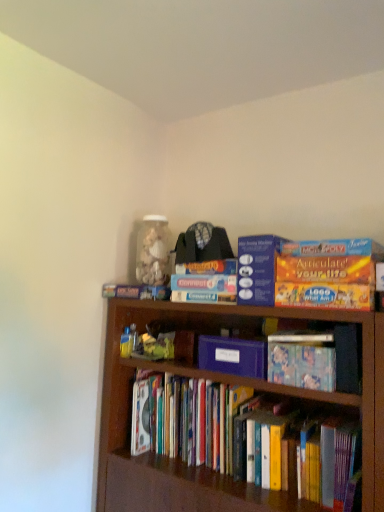
Question: From a real-world perspective, relative to blue cardboard connect 4 game at upper center, arranged as the third book when ordered from the bottom, is hardcover books at center, which ranks as the 1th book in bottom-to-top order, vertically above or below?

Choices:
 (A) below
 (B) above

Answer: (A)

Question: Considering the relative positions of hardcover books at center, which ranks as the 1th book in bottom-to-top order, and blue cardboard connect 4 game at upper center, which is the 1th book in top-to-bottom order, in the image provided, is hardcover books at center, which ranks as the 1th book in bottom-to-top order, to the left or to the right of blue cardboard connect 4 game at upper center, which is the 1th book in top-to-bottom order,?

Choices:
 (A) left
 (B) right

Answer: (B)

Question: Considering the real-world distances, which object is farthest from the purple matte paper at center, marked as the 1th paperback book in a bottom-to-top arrangement?

Choices:
 (A) hardcover books at center, which ranks as the 1th book in bottom-to-top order
 (B) hardcover book at center, which appears as the 2th book when viewed from the top
 (C) blue cardboard connect 4 game at upper center, which is the 1th book in top-to-bottom order
 (D) orange matte board game at upper center, which appears as the second paperback book when ordered from the bottom

Answer: (A)

Question: Considering the real-world distances, which object is closest to the hardcover books at center, placed as the third book when sorted from top to bottom?

Choices:
 (A) blue cardboard connect 4 game at upper center, which is the 1th book in top-to-bottom order
 (B) orange matte board game at upper center, which appears as the second paperback book when ordered from the bottom
 (C) hardcover book at center, the 2th book positioned from the bottom
 (D) purple matte paper at center, marked as the 1th paperback book in a bottom-to-top arrangement

Answer: (D)